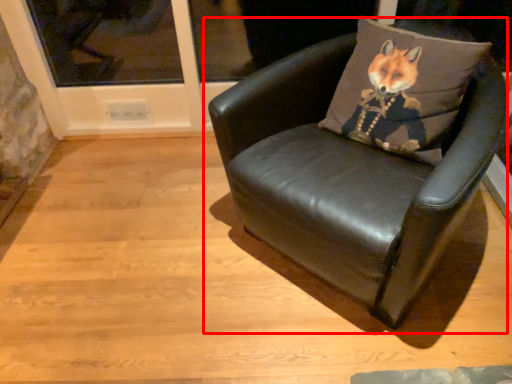
Question: In this image, where is chair (annotated by the red box) located relative to throw pillow?

Choices:
 (A) right
 (B) left

Answer: (B)